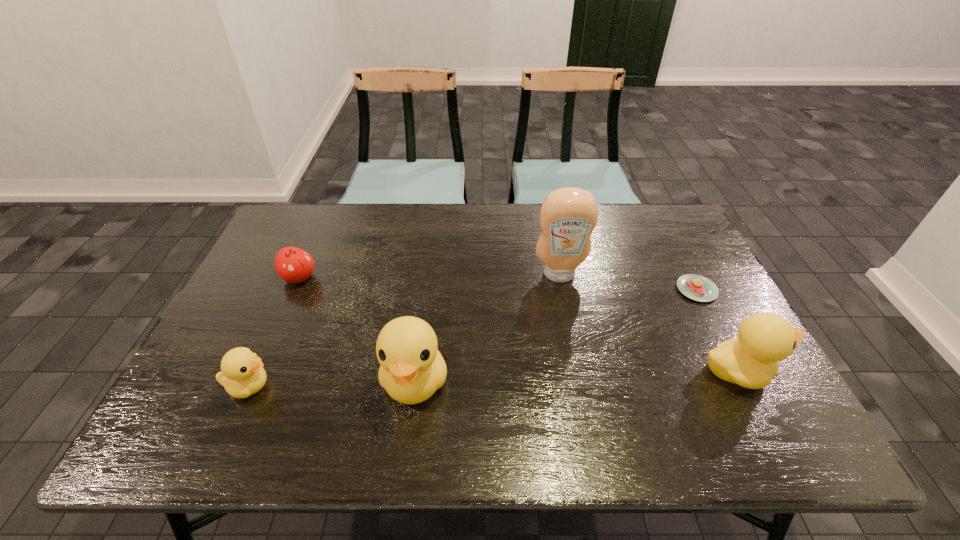
This screenshot has height=540, width=960. In order to click on the shortest duck in this screenshot , I will do `click(242, 374)`.

Find the location of a particular element. The image size is (960, 540). the fourth object from right to left is located at coordinates (411, 369).

Identify the location of the rightmost duck. The height and width of the screenshot is (540, 960). (751, 360).

This screenshot has height=540, width=960. Identify the location of the fourth shortest object. (751, 360).

Identify the location of the tallest object. Image resolution: width=960 pixels, height=540 pixels. (568, 216).

In order to click on the third object from right to left in this screenshot , I will do `click(568, 216)`.

Locate an element on the screen. The width and height of the screenshot is (960, 540). the shortest object is located at coordinates (696, 287).

What are the coordinates of `apple` in the screenshot? It's located at (294, 265).

This screenshot has height=540, width=960. I want to click on free space located on the face of the leftmost duck, so [403, 386].

Where is `vacant space located on the label of the fourth object from left to right`? The width and height of the screenshot is (960, 540). vacant space located on the label of the fourth object from left to right is located at coordinates (584, 401).